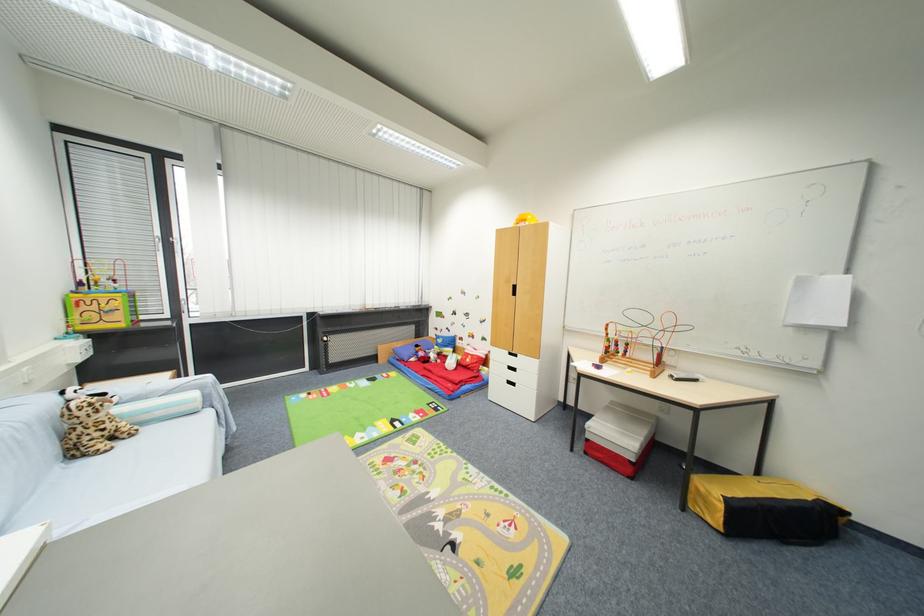
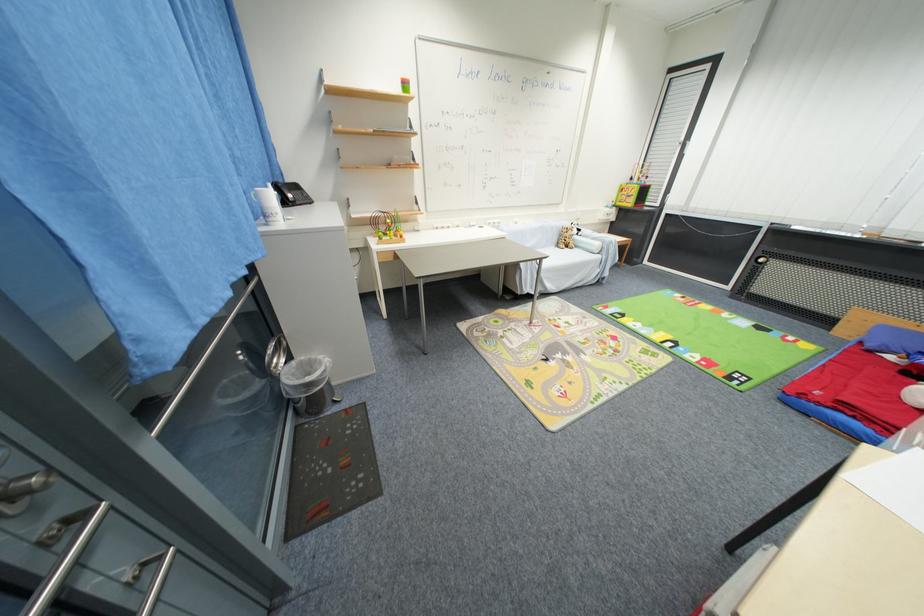
Find the pixel in the second image that matches point 79,456 in the first image.

(563, 246)